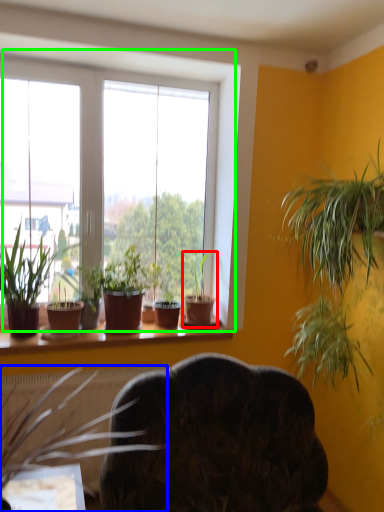
Question: Which object is the farthest from houseplant (highlighted by a red box)? Choose among these: houseplant (highlighted by a blue box) or window (highlighted by a green box).

Choices:
 (A) houseplant
 (B) window

Answer: (B)